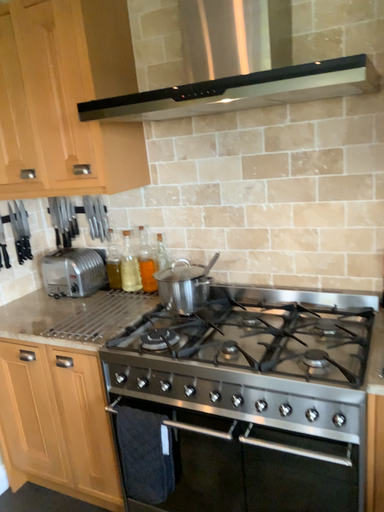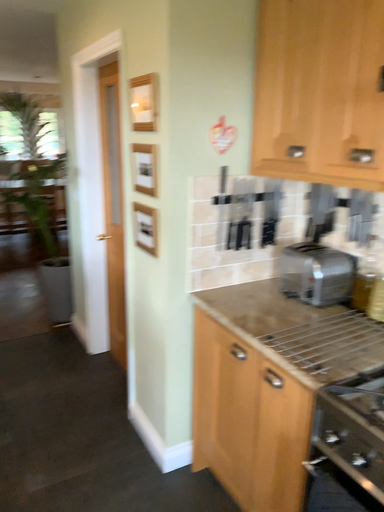
Question: How did the camera likely rotate when shooting the video?

Choices:
 (A) rotated left
 (B) rotated right

Answer: (A)